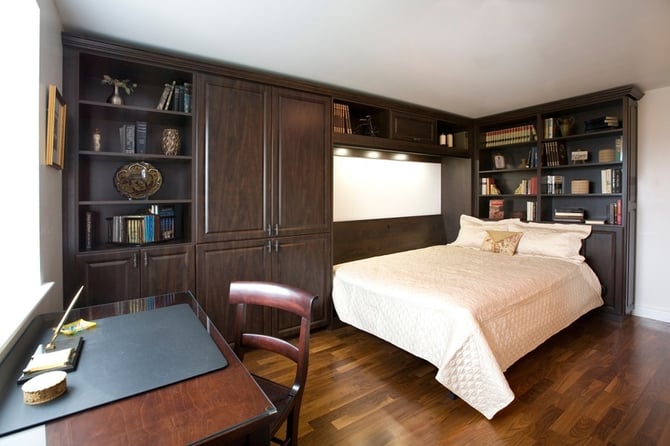
This screenshot has width=670, height=446. In order to click on pillows in this screenshot , I will do `click(482, 229)`, `click(545, 240)`, `click(500, 250)`.